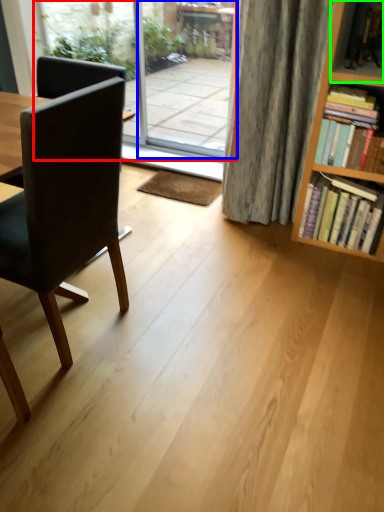
Question: Considering the real-world distances, which object is farthest from window screen (highlighted by a red box)? screen door (highlighted by a blue box) or shelf (highlighted by a green box)?

Choices:
 (A) screen door
 (B) shelf

Answer: (B)